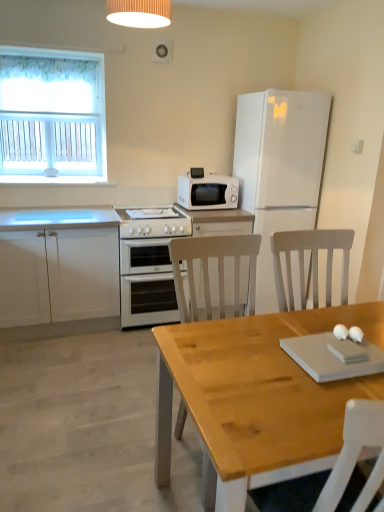
Question: From a real-world perspective, is white matte refrigerator at upper right located higher than white glossy oven at center?

Choices:
 (A) no
 (B) yes

Answer: (B)

Question: Does white matte refrigerator at upper right have a lesser height compared to white glossy oven at center?

Choices:
 (A) yes
 (B) no

Answer: (B)

Question: Is white matte refrigerator at upper right in front of white glossy oven at center?

Choices:
 (A) no
 (B) yes

Answer: (B)

Question: Is white matte refrigerator at upper right to the right of white glossy oven at center from the viewer's perspective?

Choices:
 (A) no
 (B) yes

Answer: (B)

Question: Can you confirm if white matte refrigerator at upper right is bigger than white glossy oven at center?

Choices:
 (A) no
 (B) yes

Answer: (B)

Question: In terms of width, does white ribbed lampshade at upper center look wider or thinner when compared to white fabric curtain at upper left?

Choices:
 (A) wide
 (B) thin

Answer: (A)

Question: Does point (162, 10) appear closer or farther from the camera than point (102, 153)?

Choices:
 (A) farther
 (B) closer

Answer: (B)

Question: Considering the positions of white ribbed lampshade at upper center and white fabric curtain at upper left in the image, is white ribbed lampshade at upper center taller or shorter than white fabric curtain at upper left?

Choices:
 (A) short
 (B) tall

Answer: (A)

Question: Do you think white ribbed lampshade at upper center is within white fabric curtain at upper left, or outside of it?

Choices:
 (A) outside
 (B) inside

Answer: (A)

Question: From a real-world perspective, is white glossy oven at center physically located above or below white matte microwave at upper center?

Choices:
 (A) below
 (B) above

Answer: (A)

Question: Based on their positions, is white glossy oven at center located to the left or right of white matte microwave at upper center?

Choices:
 (A) right
 (B) left

Answer: (B)

Question: From the image's perspective, is white glossy oven at center located above or below white matte microwave at upper center?

Choices:
 (A) above
 (B) below

Answer: (B)

Question: Do you think white glossy oven at center is within white matte microwave at upper center, or outside of it?

Choices:
 (A) inside
 (B) outside

Answer: (B)

Question: Looking at their shapes, would you say white matte refrigerator at upper right is wider or thinner than white glossy oven at center?

Choices:
 (A) wide
 (B) thin

Answer: (A)

Question: From the image's perspective, is white matte refrigerator at upper right positioned above or below white glossy oven at center?

Choices:
 (A) above
 (B) below

Answer: (A)